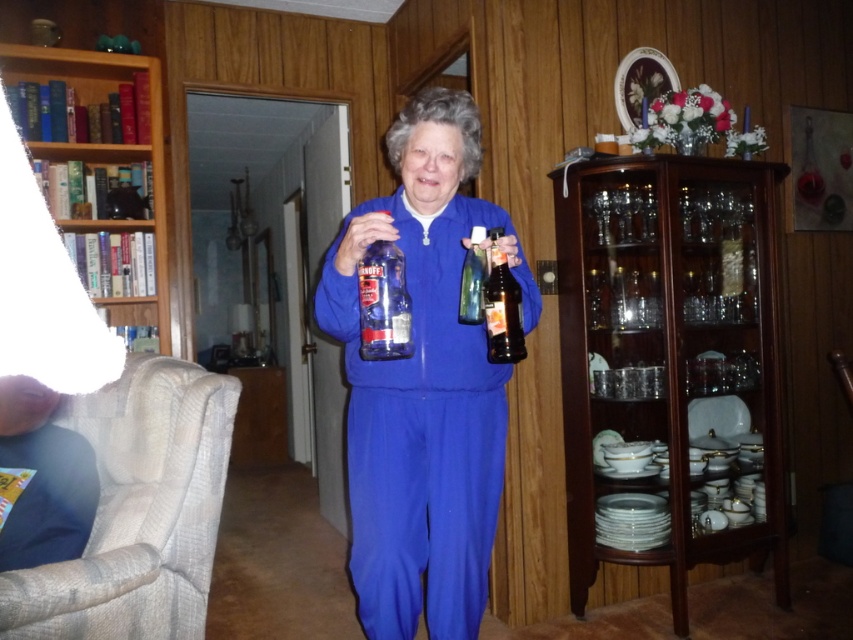
Question: Which of the following is the closest to the observer?

Choices:
 (A) transparent glass cabinet at right
 (B) woven fabric armchair at lower left

Answer: (B)

Question: In this image, where is transparent plastic bottle at center located relative to translucent glass bottle at center?

Choices:
 (A) right
 (B) left

Answer: (B)

Question: Among these points, which one is nearest to the camera?

Choices:
 (A) (209, 397)
 (B) (512, 346)

Answer: (B)

Question: Can you confirm if blue fabric woman at center is positioned above transparent plastic bottle at center?

Choices:
 (A) yes
 (B) no

Answer: (B)

Question: Among these points, which one is nearest to the camera?

Choices:
 (A) (12, 72)
 (B) (200, 504)
 (C) (459, 317)
 (D) (393, 280)

Answer: (D)

Question: Can you confirm if transparent glass cabinet at right is thinner than wooden bookshelf at left?

Choices:
 (A) yes
 (B) no

Answer: (B)